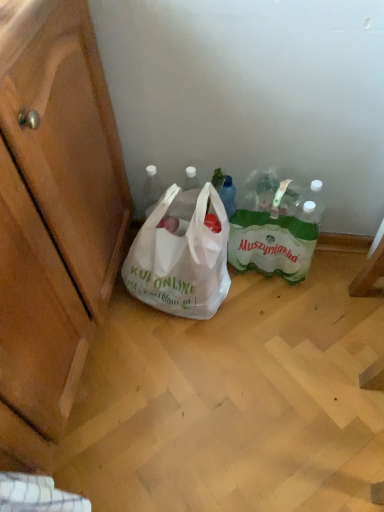
The width and height of the screenshot is (384, 512). What do you see at coordinates (180, 261) in the screenshot? I see `white plastic bag at center` at bounding box center [180, 261].

This screenshot has width=384, height=512. What are the coordinates of `white plastic bag at center` in the screenshot? It's located at (180, 261).

I want to click on white plastic bag at center, so click(x=180, y=261).